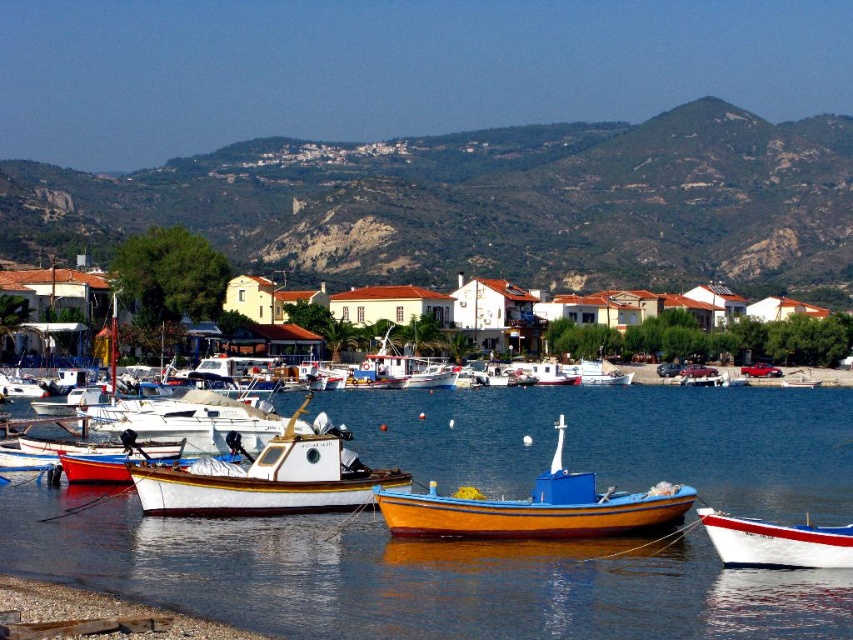
Question: Does wooden boat at center lie in front of white glossy boat at lower right?

Choices:
 (A) no
 (B) yes

Answer: (A)

Question: Is blue glossy water at center to the left of wooden boat at center from the viewer's perspective?

Choices:
 (A) yes
 (B) no

Answer: (A)

Question: Which object appears farthest from the camera in this image?

Choices:
 (A) white matte houses at center
 (B) blue glossy water at center

Answer: (A)

Question: Which object is positioned closest to the blue glossy water at center?

Choices:
 (A) wooden boat at center
 (B) white glossy boat at lower right

Answer: (A)

Question: Is blue glossy water at center thinner than wooden boat at center?

Choices:
 (A) yes
 (B) no

Answer: (B)

Question: Based on their relative distances, which object is farther from the blue glossy water at center?

Choices:
 (A) white matte houses at center
 (B) wooden boat at center
 (C) white glossy boat at lower right
 (D) brown rocky mountain at upper center

Answer: (D)